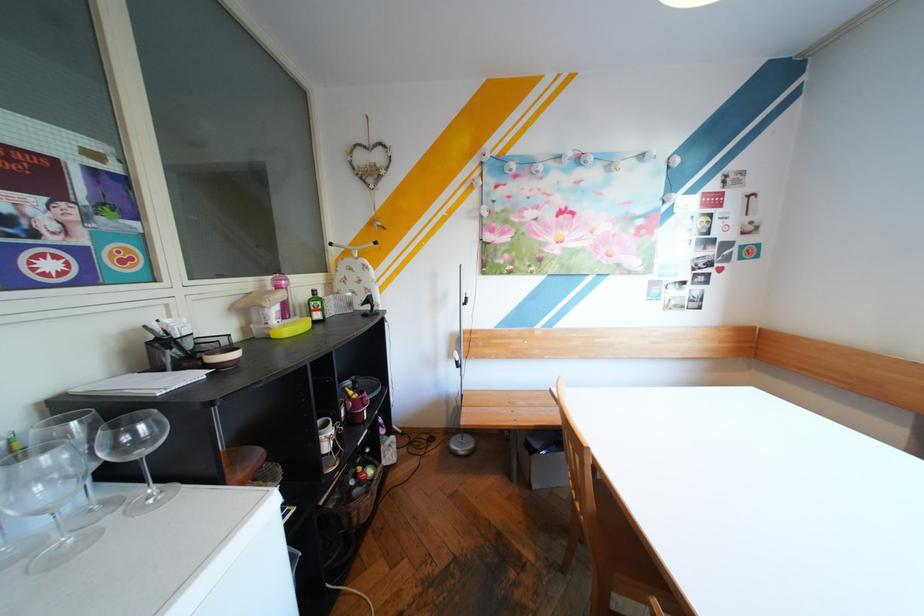
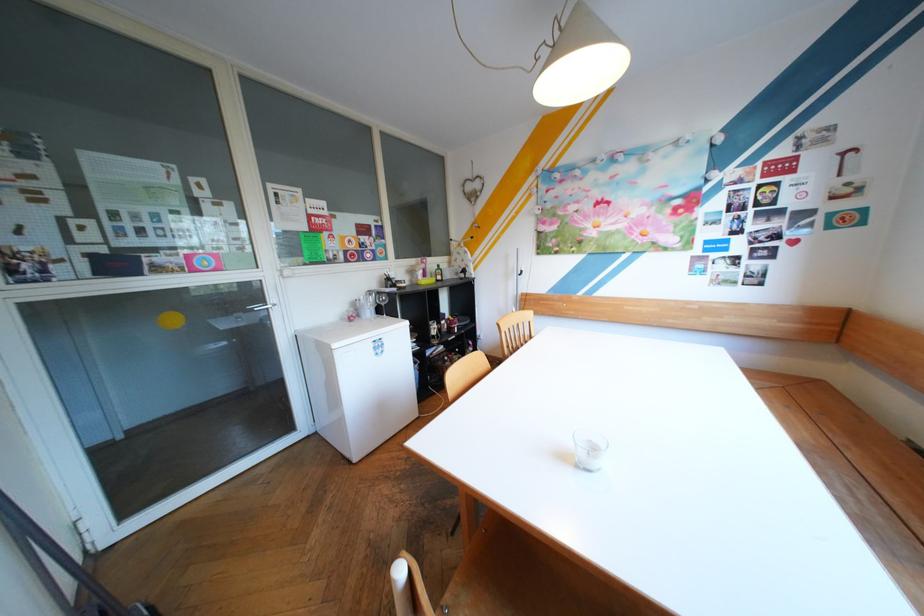
The point at (258, 283) is marked in the first image. Where is the corresponding point in the second image?

(426, 261)